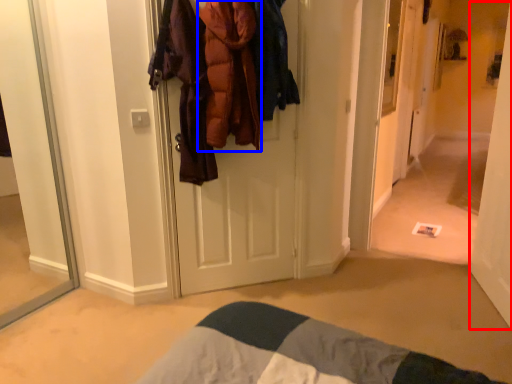
Question: Which point is further to the camera, door (highlighted by a red box) or clothing (highlighted by a blue box)?

Choices:
 (A) door
 (B) clothing

Answer: (B)